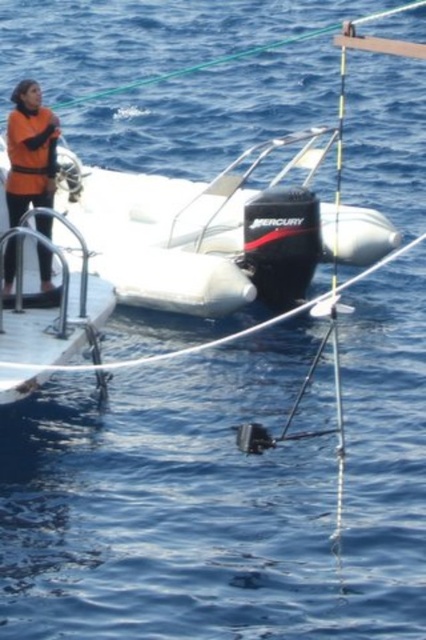
Consider the image. Can you confirm if orange fleece jacket at upper left is positioned above orange matte life jacket at left?

Incorrect, orange fleece jacket at upper left is not positioned above orange matte life jacket at left.

Describe the element at coordinates (29, 150) in the screenshot. I see `orange fleece jacket at upper left` at that location.

Is point (25, 125) positioned in front of point (52, 170)?

Yes, point (25, 125) is in front of point (52, 170).

Where is `orange fleece jacket at upper left`? orange fleece jacket at upper left is located at coordinates (29, 150).

Can you confirm if white rubber boat at center is positioned below orange matte life jacket at left?

No.

Does white rubber boat at center have a lesser width compared to orange matte life jacket at left?

No, white rubber boat at center is not thinner than orange matte life jacket at left.

Image resolution: width=426 pixels, height=640 pixels. What are the coordinates of `white rubber boat at center` in the screenshot? It's located at (215, 230).

Based on the photo, can you confirm if white rubber boat at center is positioned to the right of orange fleece jacket at upper left?

Correct, you'll find white rubber boat at center to the right of orange fleece jacket at upper left.

Who is more distant from viewer, (218, 276) or (49, 275)?

Positioned behind is point (218, 276).

Does point (190, 189) come closer to viewer compared to point (17, 164)?

No, it is not.

Locate an element on the screen. The width and height of the screenshot is (426, 640). white rubber boat at center is located at coordinates (215, 230).